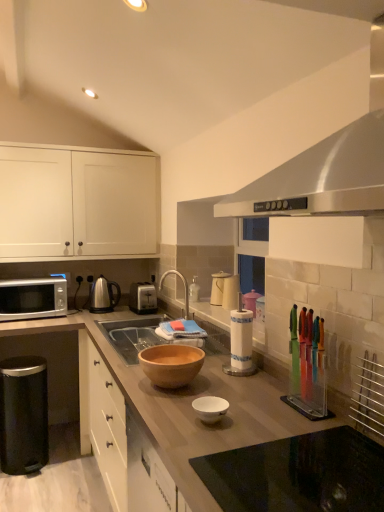
This screenshot has height=512, width=384. I want to click on vacant area on the back side of black matte trash can at lower left, which is the third appliance in front-to-back order, so click(x=62, y=435).